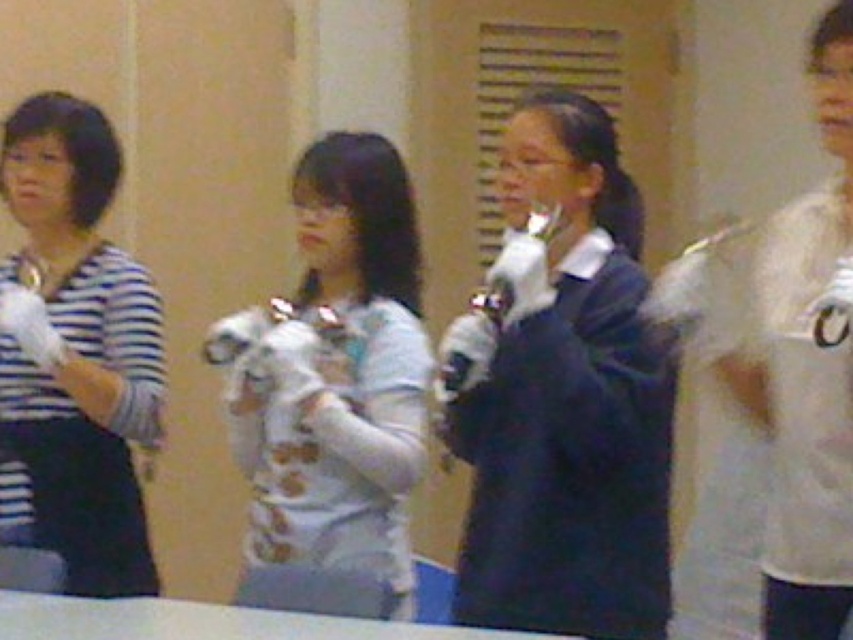
What is the color of the object at point (563,396)?

The object at point (563,396) is dark blue sweater at center.

Looking at this image, you are designing a new game controller that needs to fit comfortably between two people standing side by side. The two people are wearing the dark blue sweater at center and the white matte shirt at center. Which person should you design the controller to be narrower for, based on their clothing width?

The dark blue sweater at center has a smaller width than the white matte shirt at center, so the controller should be designed to be narrower for the person wearing the dark blue sweater at center.